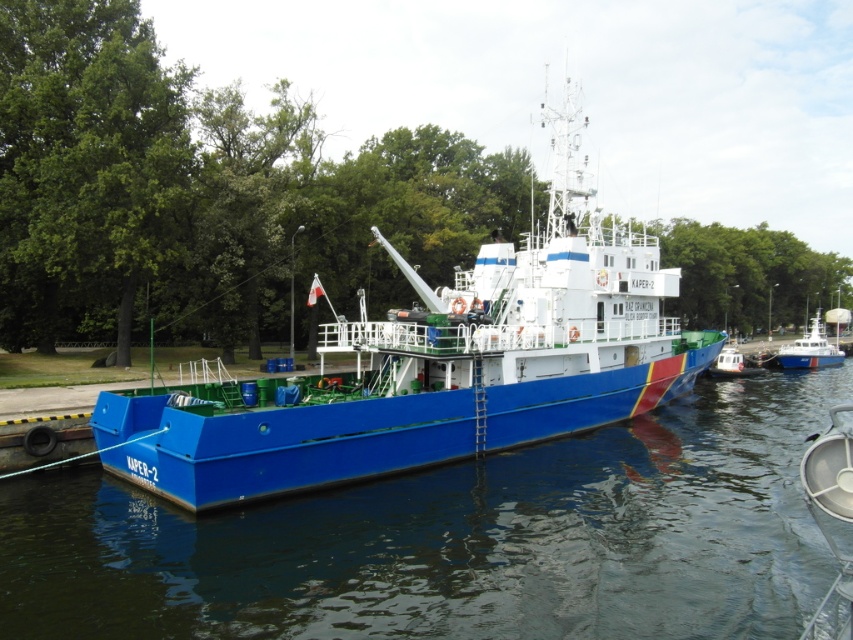
Based on the photo, does blue glossy water at center appear under blue matte boat at center?

Indeed, blue glossy water at center is positioned under blue matte boat at center.

Is blue glossy water at center positioned at the back of blue matte boat at center?

No, blue glossy water at center is in front of blue matte boat at center.

This screenshot has width=853, height=640. I want to click on blue glossy water at center, so click(x=459, y=540).

I want to click on blue glossy water at center, so click(x=459, y=540).

Is blue matte boat at center above white glossy boat at center?

Yes, blue matte boat at center is above white glossy boat at center.

Is blue matte boat at center closer to the viewer compared to white glossy boat at center?

Yes, it is in front of white glossy boat at center.

The width and height of the screenshot is (853, 640). Find the location of `blue matte boat at center`. blue matte boat at center is located at coordinates [434, 365].

Is the position of blue glossy water at center less distant than that of white glossy boat at center?

That is True.

Can you confirm if blue glossy water at center is shorter than white glossy boat at center?

Yes, blue glossy water at center is shorter than white glossy boat at center.

Does point (697, 576) lie in front of point (749, 371)?

Yes, point (697, 576) is closer to viewer.

Identify the location of blue glossy water at center. (459, 540).